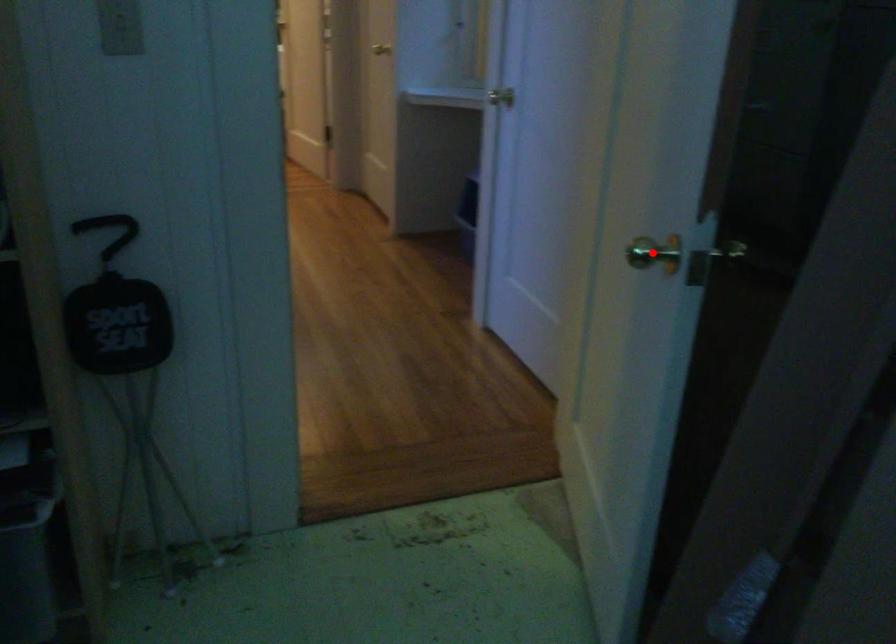
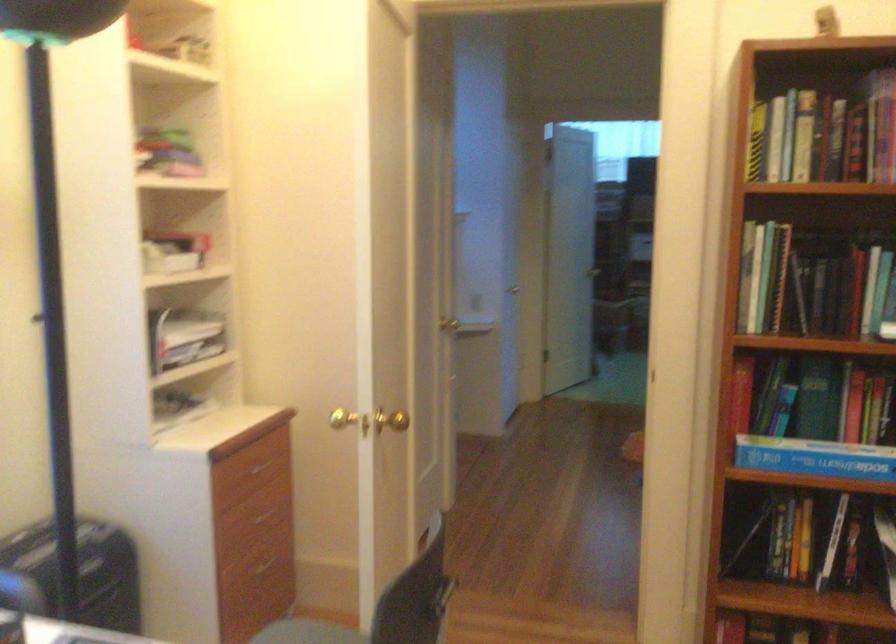
Question: I am providing you with two images of the same scene from different viewpoints. A red point is marked on the first image. Is the red point's position out of view in image 2?

Choices:
 (A) Yes
 (B) No

Answer: (A)